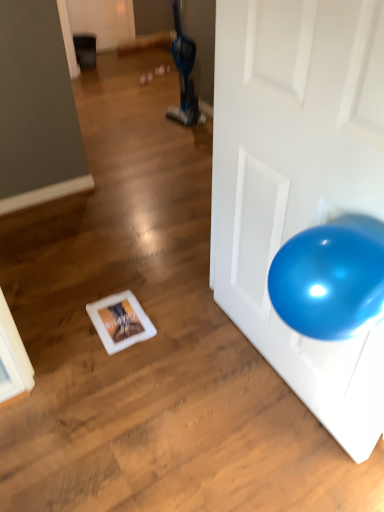
Identify the location of glossy white door at right. (298, 182).

This screenshot has height=512, width=384. What do you see at coordinates (298, 182) in the screenshot?
I see `glossy white door at right` at bounding box center [298, 182].

The image size is (384, 512). What do you see at coordinates (184, 75) in the screenshot? I see `blue fabric bean bag chair at upper center` at bounding box center [184, 75].

What is the approximate height of blue fabric bean bag chair at upper center?

It is 33.91 inches.

Identify the location of blue fabric bean bag chair at upper center. tap(184, 75).

The width and height of the screenshot is (384, 512). I want to click on glossy white door at right, so click(298, 182).

Does blue fabric bean bag chair at upper center appear on the left side of glossy white door at right?

Indeed, blue fabric bean bag chair at upper center is positioned on the left side of glossy white door at right.

Does blue fabric bean bag chair at upper center lie in front of glossy white door at right?

No.

Which is less distant, (204, 118) or (287, 356)?

Point (204, 118) is positioned farther from the camera compared to point (287, 356).

From the image's perspective, is blue fabric bean bag chair at upper center on top of glossy white door at right?

Indeed, from the image's perspective, blue fabric bean bag chair at upper center is shown above glossy white door at right.

From a real-world perspective, does blue fabric bean bag chair at upper center stand above glossy white door at right?

No, from a real-world perspective, blue fabric bean bag chair at upper center is not over glossy white door at right

Is blue fabric bean bag chair at upper center wider or thinner than glossy white door at right?

In the image, blue fabric bean bag chair at upper center appears to be wider than glossy white door at right.

Considering the sizes of objects blue fabric bean bag chair at upper center and glossy white door at right in the image provided, who is taller, blue fabric bean bag chair at upper center or glossy white door at right?

glossy white door at right.

Looking at this image, does blue fabric bean bag chair at upper center have a smaller size compared to glossy white door at right?

Yes.

Based on the photo, is blue fabric bean bag chair at upper center not inside glossy white door at right?

Yes, blue fabric bean bag chair at upper center is located beyond the bounds of glossy white door at right.

Is blue fabric bean bag chair at upper center in contact with glossy white door at right?

There is a gap between blue fabric bean bag chair at upper center and glossy white door at right.

Is blue fabric bean bag chair at upper center aimed at glossy white door at right?

No.

How different are the orientations of blue fabric bean bag chair at upper center and glossy white door at right in degrees?

6.84 degrees.

Identify the location of door on the right of blue fabric bean bag chair at upper center. (298, 182).

Based on the photo, considering the relative positions of glossy white door at right and blue fabric bean bag chair at upper center in the image provided, is glossy white door at right to the left or to the right of blue fabric bean bag chair at upper center?

Clearly, glossy white door at right is on the right of blue fabric bean bag chair at upper center in the image.

Is the position of glossy white door at right more distant than that of blue fabric bean bag chair at upper center?

No.

Between point (320, 27) and point (177, 26), which one is positioned behind?

The point (177, 26) is more distant.

From the image's perspective, which is below, glossy white door at right or blue fabric bean bag chair at upper center?

glossy white door at right appears lower in the image.

Based on the photo, from a real-world perspective, which is physically below, glossy white door at right or blue fabric bean bag chair at upper center?

blue fabric bean bag chair at upper center, from a real-world perspective.

Is glossy white door at right wider or thinner than blue fabric bean bag chair at upper center?

Clearly, glossy white door at right has less width compared to blue fabric bean bag chair at upper center.

Between glossy white door at right and blue fabric bean bag chair at upper center, which one has less height?

Standing shorter between the two is blue fabric bean bag chair at upper center.

Can you confirm if glossy white door at right is bigger than blue fabric bean bag chair at upper center?

Yes, glossy white door at right is bigger than blue fabric bean bag chair at upper center.

Is glossy white door at right outside of blue fabric bean bag chair at upper center?

glossy white door at right lies outside blue fabric bean bag chair at upper center's area.

Is glossy white door at right beside blue fabric bean bag chair at upper center?

glossy white door at right and blue fabric bean bag chair at upper center are not in contact.

Is glossy white door at right looking in the opposite direction of blue fabric bean bag chair at upper center?

No.

How many degrees apart are the facing directions of glossy white door at right and blue fabric bean bag chair at upper center?

6.84 degrees separate the facing orientations of glossy white door at right and blue fabric bean bag chair at upper center.

Measure the distance from glossy white door at right to blue fabric bean bag chair at upper center.

A distance of 7.29 feet exists between glossy white door at right and blue fabric bean bag chair at upper center.

At what (x,y) coordinates should I click in order to perform the action: click on bean bag chair on the left of glossy white door at right. Please return your answer as a coordinate pair (x, y). Looking at the image, I should click on (184, 75).

What are the coordinates of `bean bag chair that appears on the left of glossy white door at right` in the screenshot? It's located at (184, 75).

Find the location of a particular element. door in front of the blue fabric bean bag chair at upper center is located at coordinates (298, 182).